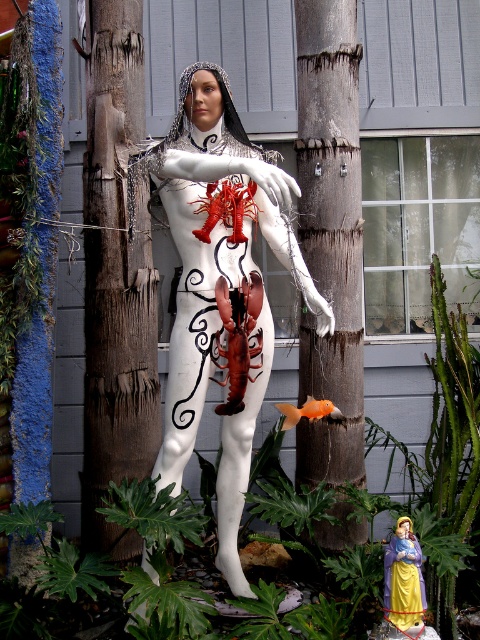
You are an artist planning to photograph the white matte sculpture at center and the smooth brown wood at center. Since you want to emphasize the sculpture, which object should you place closer to the camera to ensure it appears larger in the photo?

The white matte sculpture at center is already bigger than the smooth brown wood at center, so to emphasize it further, you should place the white matte sculpture at center closer to the camera. This will make it appear even larger in the photo compared to the smooth brown wood at center.

You are an art student analyzing the sculpture and its surroundings. From your perspective, which object is positioned to the right side of the other between the white matte sculpture at center and the smooth brown wood at center?

The white matte sculpture at center is to the left of the smooth brown wood at center, so the smooth brown wood at center is positioned to the right side of the white matte sculpture at center.